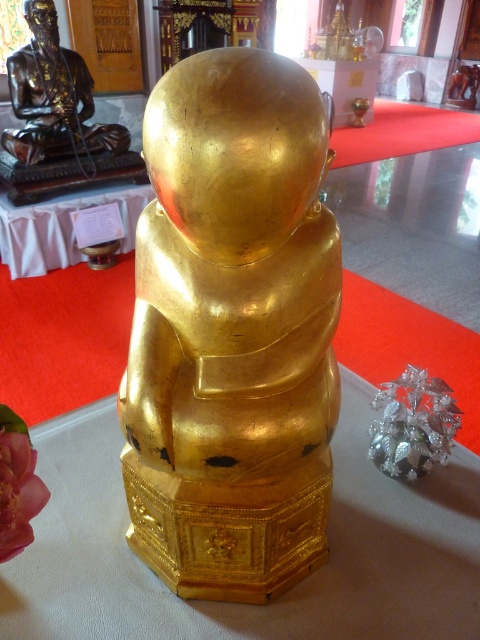
Question: Can you confirm if gold polished statue at center is thinner than bronze statue at upper left?

Choices:
 (A) yes
 (B) no

Answer: (A)

Question: In this image, where is gold polished statue at center located relative to bronze statue at upper left?

Choices:
 (A) below
 (B) above

Answer: (A)

Question: Is gold polished statue at center smaller than bronze statue at upper left?

Choices:
 (A) no
 (B) yes

Answer: (B)